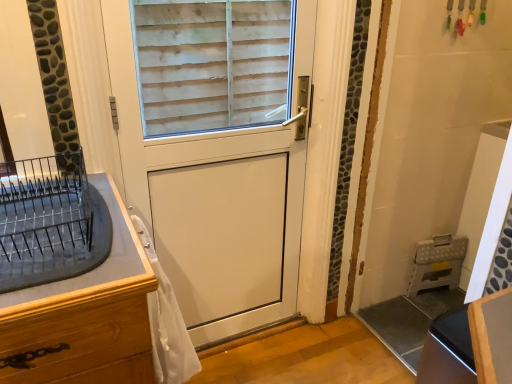
Question: From a real-world perspective, is black metal dish rack at left, which appears as the second appliance when viewed from the right, physically above white sheer fabric at lower left?

Choices:
 (A) no
 (B) yes

Answer: (B)

Question: Can you confirm if black metal dish rack at left, marked as the 1th appliance in a left-to-right arrangement, is smaller than white sheer fabric at lower left?

Choices:
 (A) yes
 (B) no

Answer: (B)

Question: Can you confirm if black metal dish rack at left, which appears as the second appliance when viewed from the right, is thinner than white sheer fabric at lower left?

Choices:
 (A) no
 (B) yes

Answer: (A)

Question: Could you tell me if black metal dish rack at left, marked as the 1th appliance in a left-to-right arrangement, is turned towards white sheer fabric at lower left?

Choices:
 (A) no
 (B) yes

Answer: (A)

Question: Is white sheer fabric at lower left surrounded by black metal dish rack at left, which is counted as the 2th appliance, starting from the back?

Choices:
 (A) no
 (B) yes

Answer: (A)

Question: Is point (164, 306) positioned closer to the camera than point (429, 286)?

Choices:
 (A) closer
 (B) farther

Answer: (A)

Question: In terms of height, does white sheer fabric at lower left look taller or shorter compared to white plastic folding stool at lower right, the first appliance when ordered from back to front?

Choices:
 (A) tall
 (B) short

Answer: (A)

Question: From the image's perspective, is white sheer fabric at lower left positioned above or below white plastic folding stool at lower right, the 2th appliance from the top?

Choices:
 (A) below
 (B) above

Answer: (B)

Question: In terms of width, does white sheer fabric at lower left look wider or thinner when compared to white plastic folding stool at lower right, the second appliance from the front?

Choices:
 (A) thin
 (B) wide

Answer: (B)

Question: Considering the relative positions of black metal dish rack at left, marked as the 1th appliance in a left-to-right arrangement, and white sheer fabric at lower left in the image provided, is black metal dish rack at left, marked as the 1th appliance in a left-to-right arrangement, to the left or to the right of white sheer fabric at lower left?

Choices:
 (A) left
 (B) right

Answer: (A)

Question: Is black metal dish rack at left, marked as the 1th appliance in a left-to-right arrangement, taller or shorter than white sheer fabric at lower left?

Choices:
 (A) short
 (B) tall

Answer: (A)

Question: From a real-world perspective, is black metal dish rack at left, marked as the 1th appliance in a left-to-right arrangement, above or below white sheer fabric at lower left?

Choices:
 (A) below
 (B) above

Answer: (B)

Question: Relative to white sheer fabric at lower left, is black metal dish rack at left, the first appliance from the top, in front or behind?

Choices:
 (A) front
 (B) behind

Answer: (A)

Question: From the image's perspective, is black glossy vanity at lower right located above or below white sheer fabric at lower left?

Choices:
 (A) above
 (B) below

Answer: (B)

Question: Do you think black glossy vanity at lower right is within white sheer fabric at lower left, or outside of it?

Choices:
 (A) outside
 (B) inside

Answer: (A)